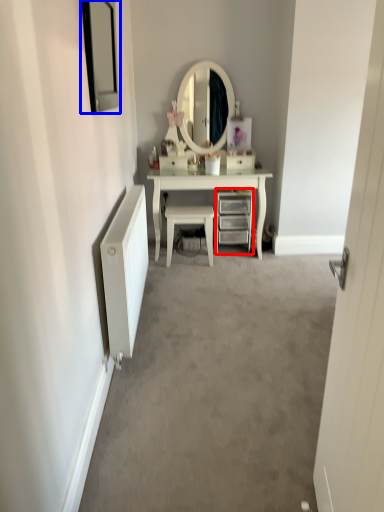
Question: Which object appears closest to the camera in this image, chest of drawers (highlighted by a red box) or picture frame (highlighted by a blue box)?

Choices:
 (A) chest of drawers
 (B) picture frame

Answer: (B)